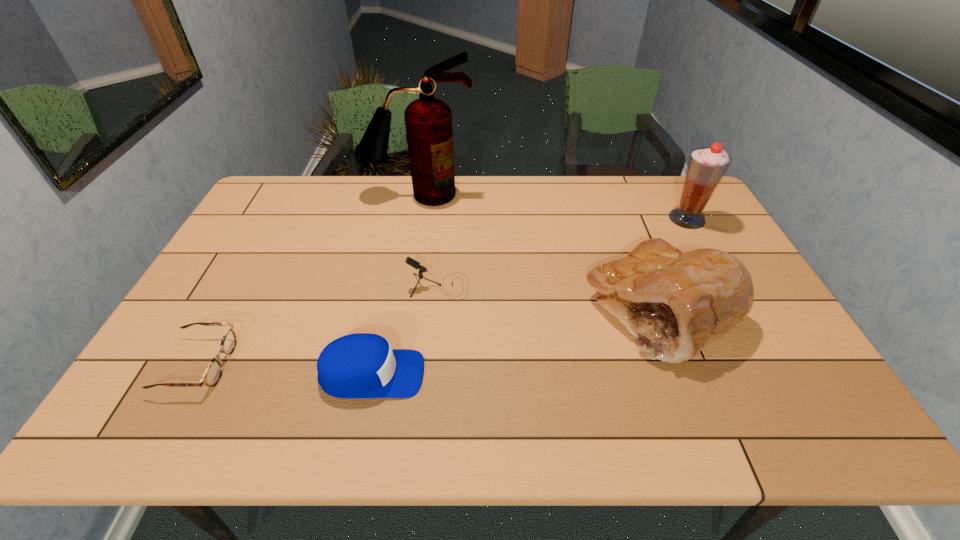
Where is `object located at the left edge`? object located at the left edge is located at coordinates (213, 372).

At what (x,y) coordinates should I click in order to perform the action: click on smoothie positioned at the right edge. Please return your answer as a coordinate pair (x, y). The height and width of the screenshot is (540, 960). Looking at the image, I should click on (706, 167).

This screenshot has width=960, height=540. Find the location of `bread that is at the right edge`. bread that is at the right edge is located at coordinates (675, 303).

In order to click on object located in the far right corner section of the desktop in this screenshot , I will do `click(706, 167)`.

Identify the location of vacant space at the far edge of the desktop. This screenshot has height=540, width=960. (526, 184).

I want to click on vacant region at the left edge, so click(x=238, y=236).

The image size is (960, 540). Find the location of `vacant space at the far right corner of the desktop`. vacant space at the far right corner of the desktop is located at coordinates (670, 198).

Locate an element on the screen. vacant space that is in between the spectacles and the microphone is located at coordinates (319, 325).

This screenshot has height=540, width=960. I want to click on vacant space that's between the baseball cap and the fifth shortest object, so (x=529, y=296).

Image resolution: width=960 pixels, height=540 pixels. Identify the location of vacant space in between the shortest object and the smoothie. point(443,292).